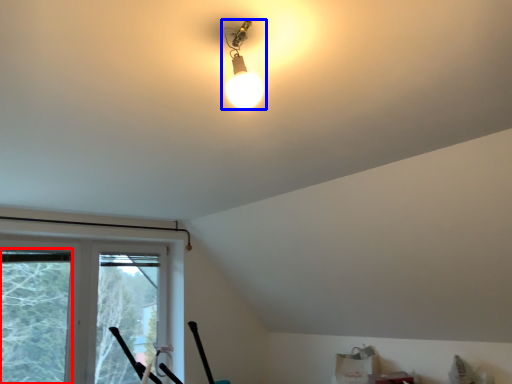
Question: Which object appears closest to the camera in this image, window screen (highlighted by a red box) or lamp (highlighted by a blue box)?

Choices:
 (A) window screen
 (B) lamp

Answer: (B)